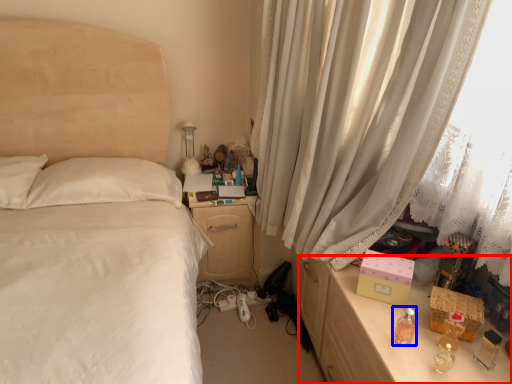
Question: Which object is further to the camera taking this photo, vanity (highlighted by a red box) or perfume (highlighted by a blue box)?

Choices:
 (A) vanity
 (B) perfume

Answer: (B)